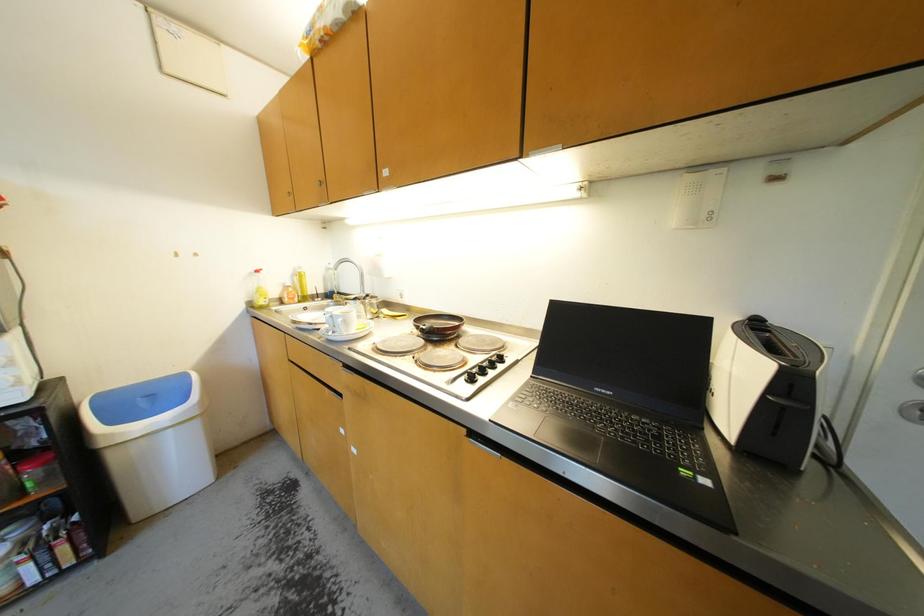
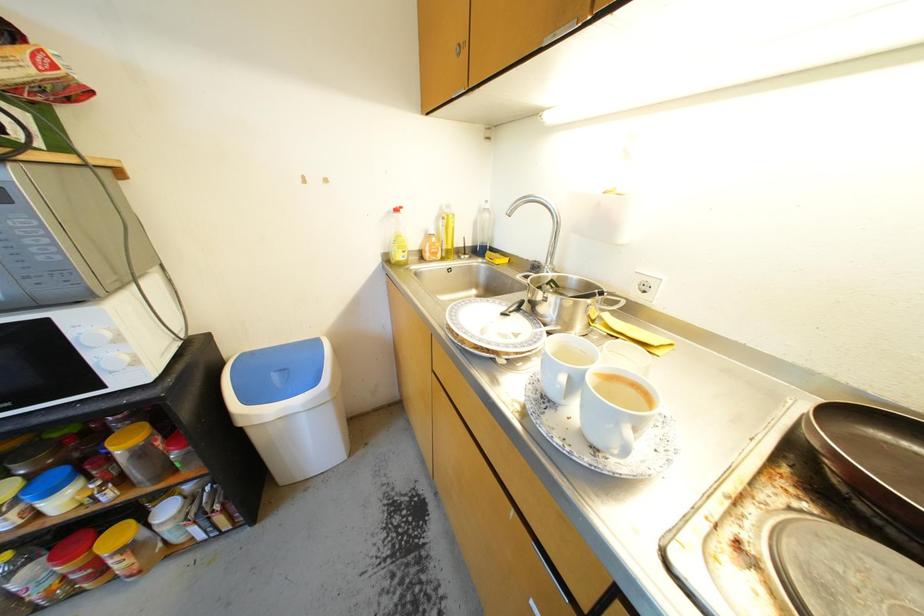
First-person continuous shooting, in which direction is the camera rotating?

The rotation direction of the camera is left-down.